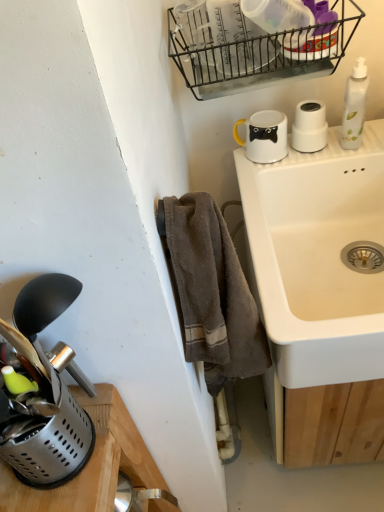
Find the location of a particular element. The height and width of the screenshot is (512, 384). free space above black wire basket at upper center (from a real-world perspective) is located at coordinates (259, 6).